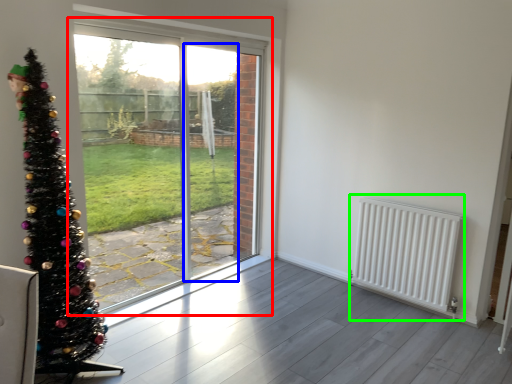
Question: Based on their relative distances, which object is farther from window (highlighted by a red box)? Choose from screen door (highlighted by a blue box) and radiator (highlighted by a green box).

Choices:
 (A) screen door
 (B) radiator

Answer: (B)